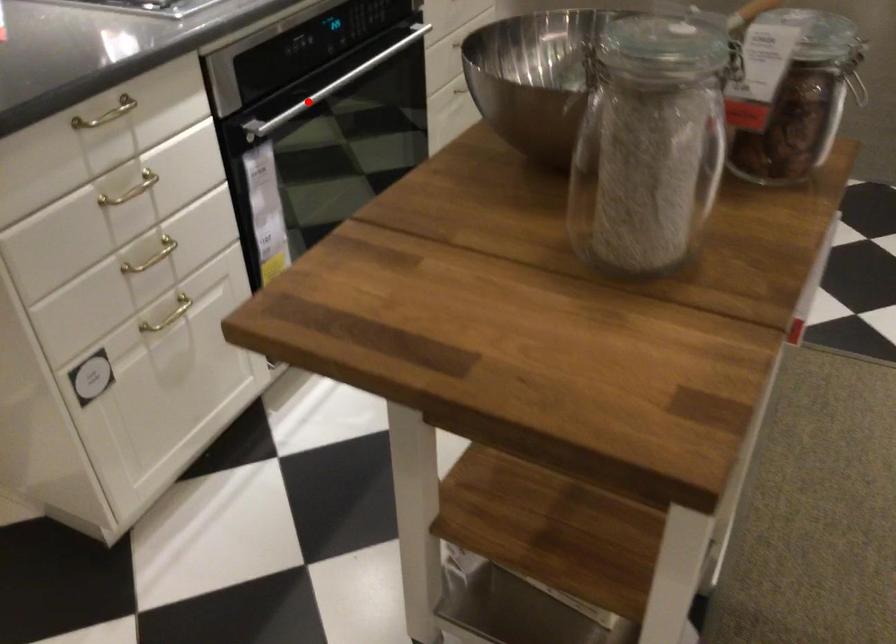
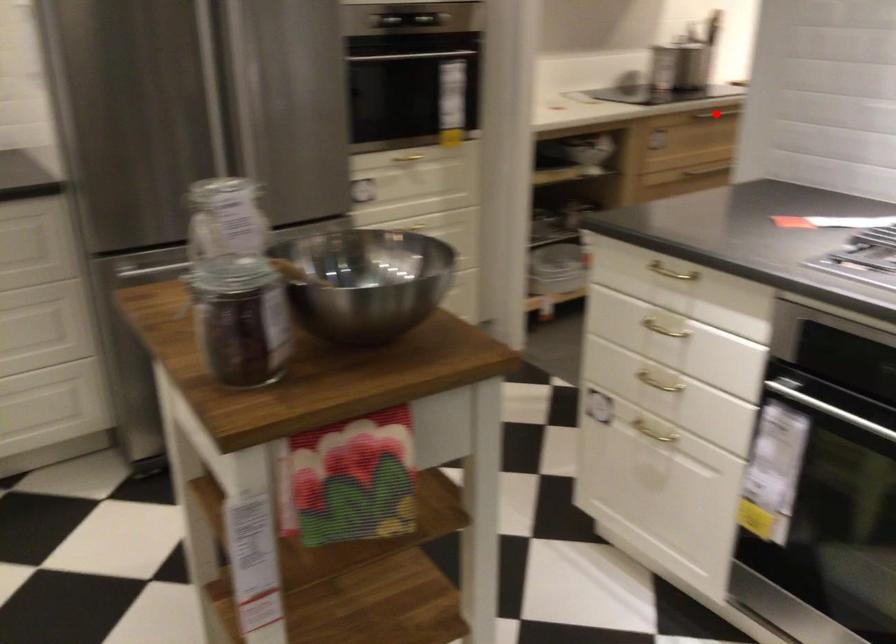
I am providing you with two images of the same scene from different viewpoints. A red point is marked on the first image and another point is marked on the second image. Is the red point in image1 aligned with the point shown in image2?

No